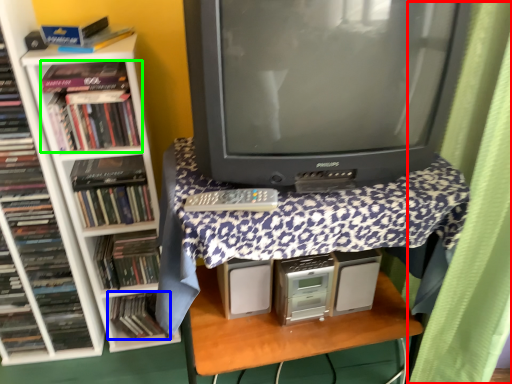
Question: Which is farther away from curtain (highlighted by a red box)? book (highlighted by a blue box) or book (highlighted by a green box)?

Choices:
 (A) book
 (B) book

Answer: (A)